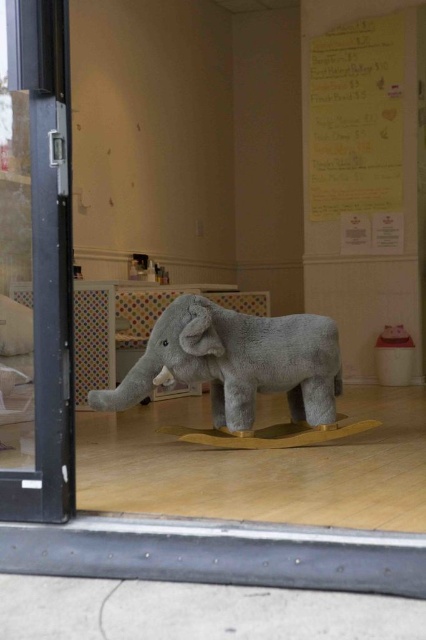
You are a student entering the classroom and notice the yellow paper at upper center and the gray plush elephant at center. Which object is higher up on the wall?

The yellow paper at upper center is positioned over the gray plush elephant at center, so it is higher up on the wall.

You are a student entering the classroom through the transparent glass door at left. You notice the yellow paper at upper center on the wall. Which object takes up more space in the room?

The yellow paper at upper center occupies more space than the transparent glass door at left.